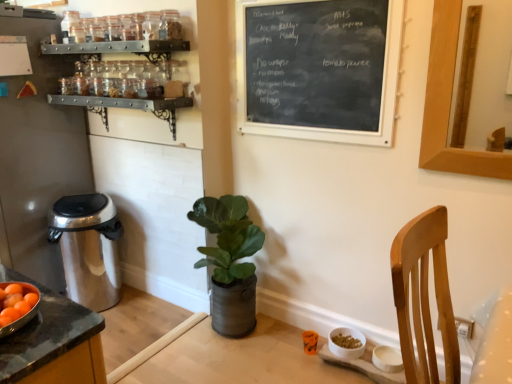
Locate an element on the screen. The image size is (512, 384). free space on the front side of green leafy plant in metallic pot at center is located at coordinates (236, 362).